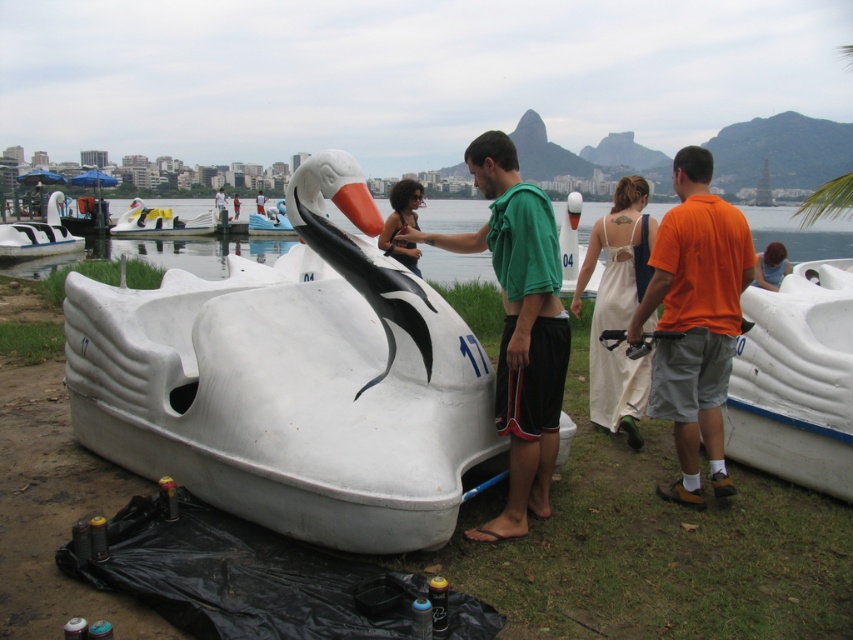
You are a photographer at the waterfront scene. You need to take a photo of the white satin dress at center and the white matte swan boat at center. Based on their positions, which object should appear lower in your photo?

The white satin dress at center is positioned under the white matte swan boat at center, so the white satin dress at center will appear lower in the photo.